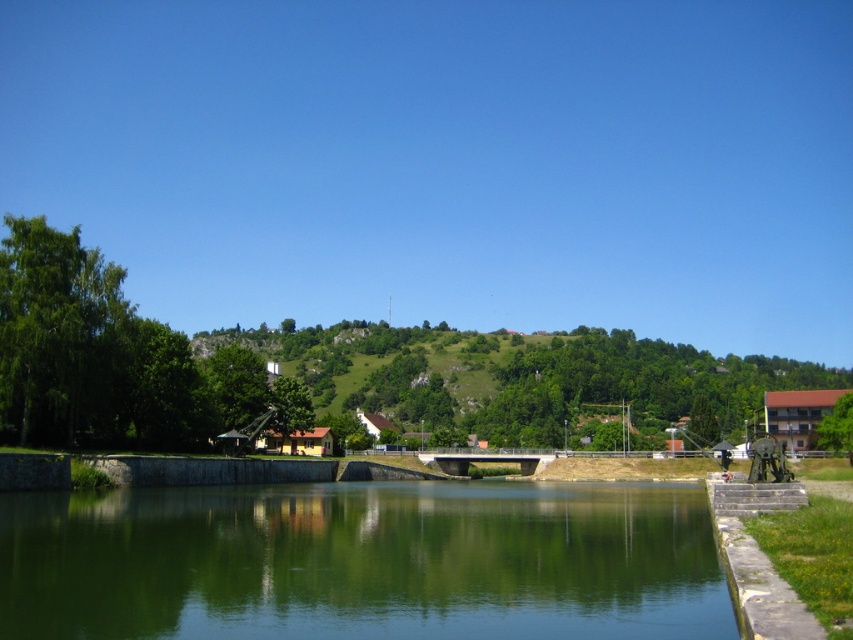
Question: Does green smooth water at center have a lesser width compared to green grassy hillside at center?

Choices:
 (A) yes
 (B) no

Answer: (A)

Question: Among these points, which one is farthest from the camera?

Choices:
 (A) (666, 376)
 (B) (44, 580)

Answer: (A)

Question: Which object is farther from the camera taking this photo?

Choices:
 (A) green grassy hillside at center
 (B) green smooth water at center

Answer: (A)

Question: Considering the relative positions of green smooth water at center and green grassy hillside at center in the image provided, where is green smooth water at center located with respect to green grassy hillside at center?

Choices:
 (A) right
 (B) left

Answer: (B)

Question: Does green smooth water at center lie behind green grassy hillside at center?

Choices:
 (A) yes
 (B) no

Answer: (B)